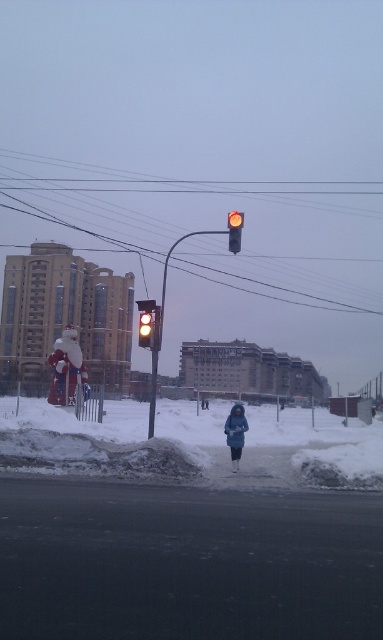
You are a delivery person trying to navigate through the winter street. You see the dark blue woolen coat at center and the yellow glass traffic light at left. Which object is narrower in width?

The dark blue woolen coat at center is thinner than the yellow glass traffic light at left, so the dark blue woolen coat at center is narrower in width.

You are a pedestrian wanting to cross the street safely. You see the white powdery snow at lower center and the yellow matte traffic light at upper center. Which object is closer to the ground?

The white powdery snow at lower center is shorter than the yellow matte traffic light at upper center, so the white powdery snow at lower center is closer to the ground.